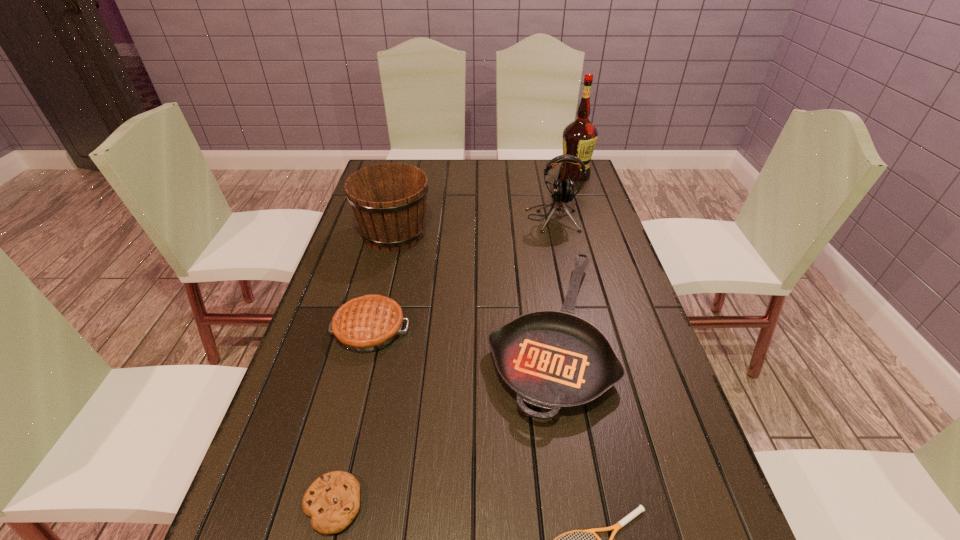
The image size is (960, 540). I want to click on vacant space situated on the front of the fourth shortest object, so click(x=342, y=441).

I want to click on vacant area situated on the left of the frying pan, so click(x=350, y=332).

I want to click on free spot located on the right of the cookie, so click(553, 504).

This screenshot has height=540, width=960. Find the location of `object located at the far edge`. object located at the far edge is located at coordinates (579, 137).

I want to click on wine bucket located at the left edge, so click(389, 199).

Image resolution: width=960 pixels, height=540 pixels. What are the coordinates of `pie positioned at the left edge` in the screenshot? It's located at (368, 323).

You are a GUI agent. You are given a task and a screenshot of the screen. Output one action in this format:
    pyautogui.click(x=<x>, y=<y>)
    Task: Click on the cookie at the left edge
    This screenshot has width=960, height=540.
    Given the screenshot: What is the action you would take?
    pyautogui.click(x=332, y=501)

In order to click on alcohol located in the right edge section of the desktop in this screenshot , I will do `click(579, 137)`.

Identify the location of earphone that is positioned at the right edge. [x=562, y=190].

Identify the location of frying pan located in the right edge section of the desktop. The width and height of the screenshot is (960, 540). (554, 360).